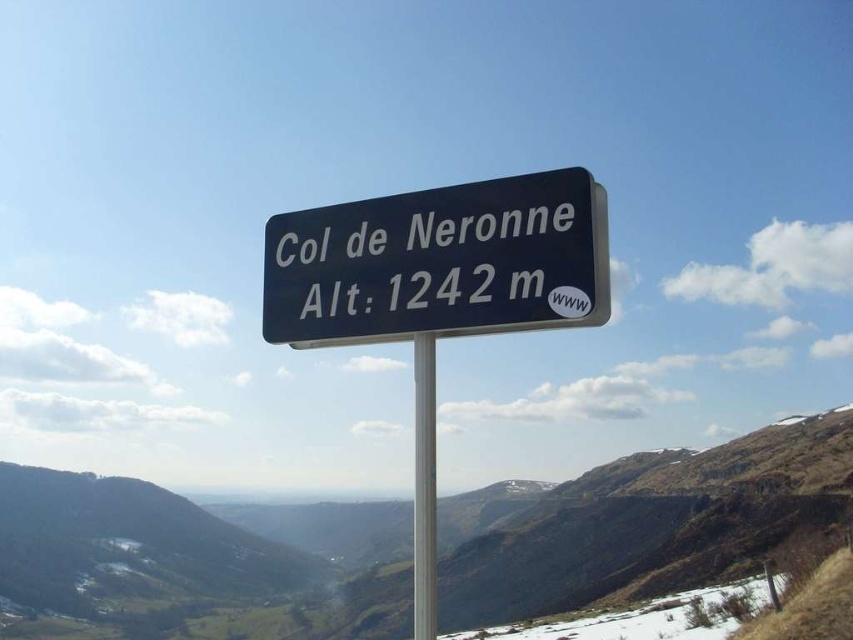
Question: Can you confirm if black plastic sign at center is bigger than silver metallic pole at center?

Choices:
 (A) yes
 (B) no

Answer: (B)

Question: Which object appears farthest from the camera in this image?

Choices:
 (A) silver metallic pole at center
 (B) green grassy mountain at center
 (C) black plastic sign at center

Answer: (B)

Question: Which of the following is the farthest from the observer?

Choices:
 (A) silver metallic pole at center
 (B) black plastic sign at center
 (C) green grassy mountain at center

Answer: (C)

Question: Is black plastic sign at center above silver metallic pole at center?

Choices:
 (A) no
 (B) yes

Answer: (B)

Question: Which is farther from the green grassy mountain at center?

Choices:
 (A) black plastic sign at center
 (B) silver metallic pole at center

Answer: (A)

Question: From the image, what is the correct spatial relationship of green grassy mountain at center in relation to silver metallic pole at center?

Choices:
 (A) left
 (B) right

Answer: (A)